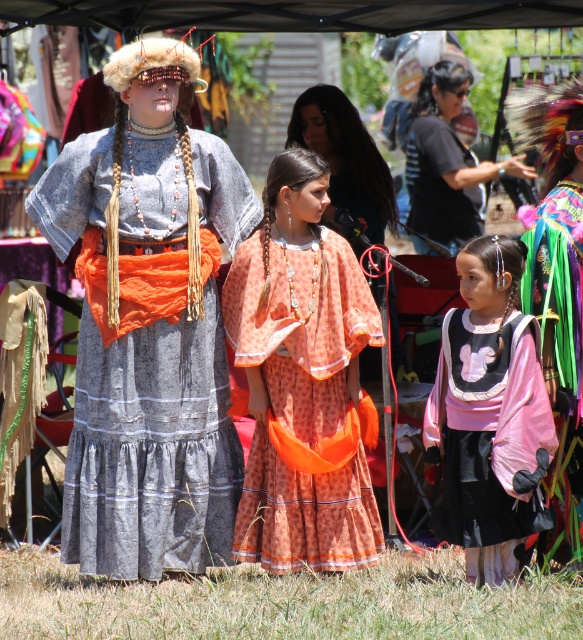
Who is more distant from viewer, [477,198] or [311,125]?

The point [477,198] is more distant.

Is point (423, 188) in front of point (311, 131)?

No, (423, 188) is further to viewer.

Locate an element on the screen. The height and width of the screenshot is (640, 583). matte black shirt at upper center is located at coordinates (448, 163).

This screenshot has height=640, width=583. What are the coordinates of `matte black shirt at upper center` in the screenshot? It's located at (448, 163).

Looking at this image, can you confirm if multicolored feather headdress at upper right is taller than matte black shirt at upper center?

Indeed, multicolored feather headdress at upper right has a greater height compared to matte black shirt at upper center.

You are a GUI agent. You are given a task and a screenshot of the screen. Output one action in this format:
    pyautogui.click(x=<x>, y=<y>)
    Task: Click on the multicolored feather headdress at upper right
    
    Given the screenshot: What is the action you would take?
    pyautogui.click(x=559, y=340)

Based on the photo, between matte black shirt at upper center and black cotton shirt at upper center, which one is positioned higher?

matte black shirt at upper center is higher up.

Can you confirm if matte black shirt at upper center is positioned to the left of black cotton shirt at upper center?

Incorrect, matte black shirt at upper center is not on the left side of black cotton shirt at upper center.

The image size is (583, 640). Identify the location of matte black shirt at upper center. (448, 163).